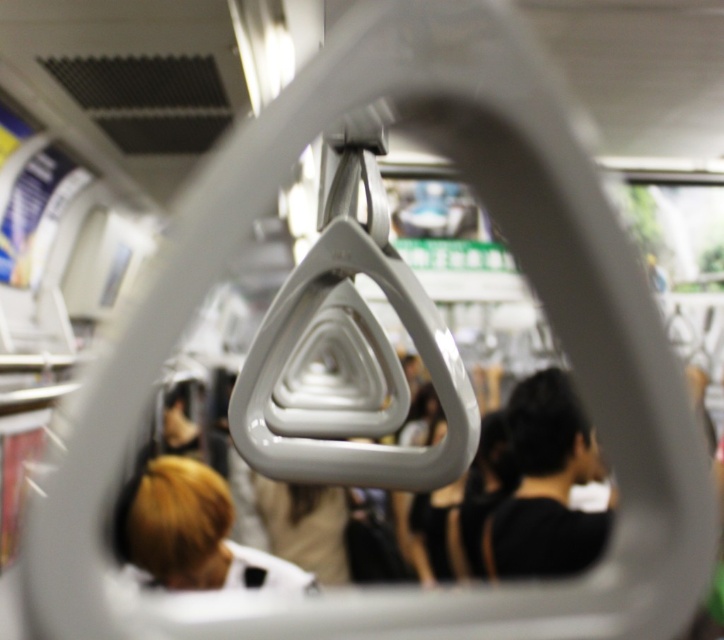
You are a photographer taking a picture through the triangular handrail. You notice two passengers in the background with distinct hairstyles. The first has black matte hair at center, and the second has blonde hair at lower left. Which hairstyle appears bigger in the photo?

The black matte hair at center appears bigger in the photo because it is larger in size than the blonde hair at lower left.